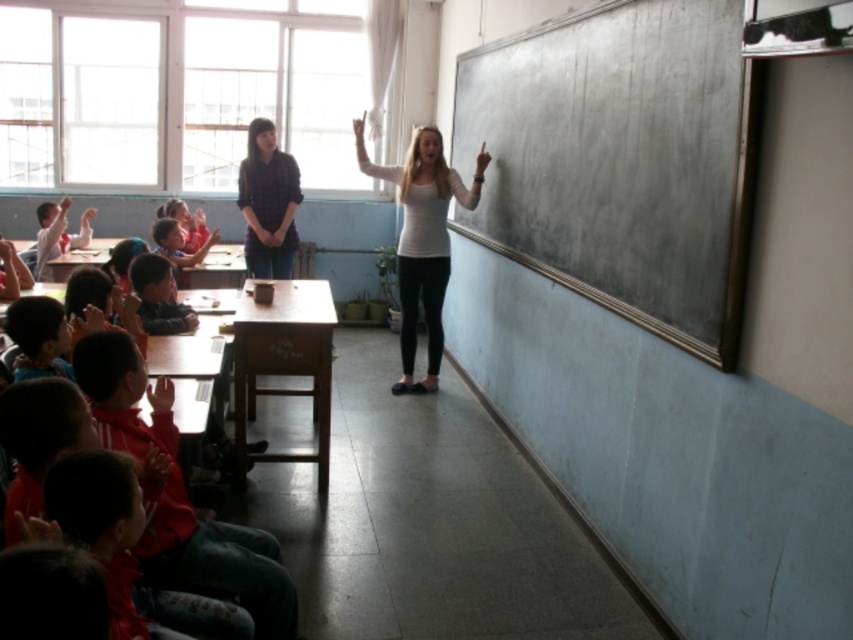
You are a student sitting at the wooden table at center and want to see the red jacket at lower left. Can you see it without moving your head?

The red jacket at lower left has a lesser height compared to wooden table at center, so yes, you can see it without moving your head because the red jacket at lower left is shorter than the wooden table at center.

You are a student sitting at the back of the classroom. You want to see the smooth blackboard at right clearly. Can you see the white matte shirt at center in your line of sight to the blackboard?

The smooth blackboard at right is in front of the white matte shirt at center, so the white matte shirt at center will block your view of the smooth blackboard at right. You cannot see the blackboard clearly because the shirt is in the way.

You are a student sitting at the back of the classroom. You want to ask a question but need to get the teacher to notice you. The teacher is wearing the white matte shirt at center and standing near the smooth blackboard at right. Which direction should you move to get closer to the teacher?

A: You should move to the right because the smooth blackboard at right is to the right of the white matte shirt at center, meaning the teacher is standing closer to the blackboard on the right side of the classroom.